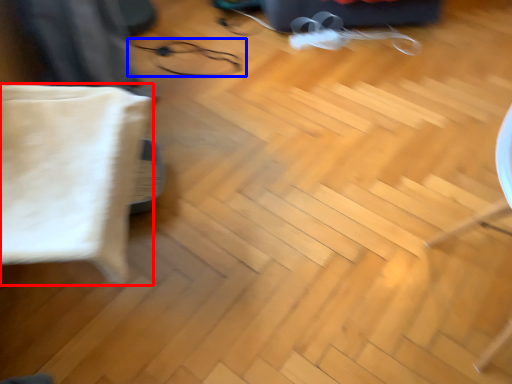
Question: Which object appears closest to the camera in this image, pillow (highlighted by a red box) or glasses (highlighted by a blue box)?

Choices:
 (A) pillow
 (B) glasses

Answer: (A)